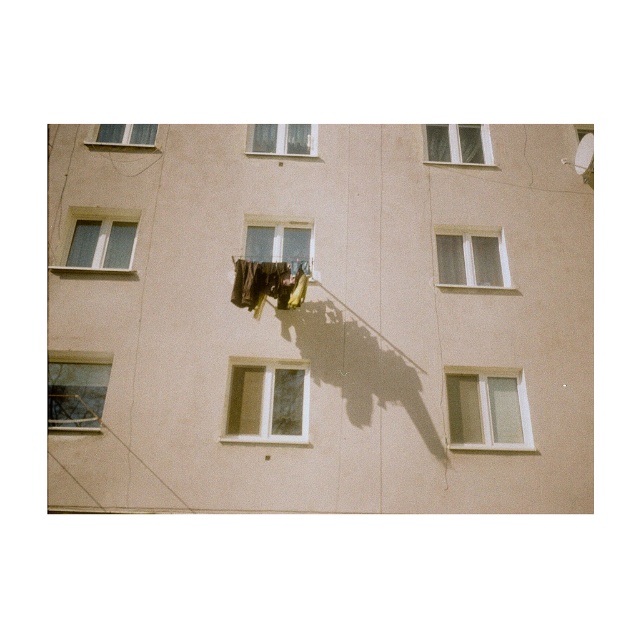
Is clear glass window at lower left to the left of white plastic window at upper right from the viewer's perspective?

Indeed, clear glass window at lower left is positioned on the left side of white plastic window at upper right.

What do you see at coordinates (76, 388) in the screenshot? I see `clear glass window at lower left` at bounding box center [76, 388].

Does point (106, 362) come in front of point (495, 266)?

That is True.

Locate an element on the screen. clear glass window at lower left is located at coordinates click(76, 388).

Looking at this image, who is higher up, white plastic window at center or white plastic window at upper right?

Positioned higher is white plastic window at upper right.

Is white plastic window at center to the left of white plastic window at upper right from the viewer's perspective?

Indeed, white plastic window at center is positioned on the left side of white plastic window at upper right.

This screenshot has height=640, width=636. Describe the element at coordinates (266, 403) in the screenshot. I see `white plastic window at center` at that location.

The height and width of the screenshot is (640, 636). Find the location of `white plastic window at center`. white plastic window at center is located at coordinates [266, 403].

Is white plastic window at lower right to the right of white plastic window at upper right from the viewer's perspective?

Incorrect, white plastic window at lower right is not on the right side of white plastic window at upper right.

Is white plastic window at lower right smaller than white plastic window at upper right?

No.

The width and height of the screenshot is (636, 640). Describe the element at coordinates (487, 410) in the screenshot. I see `white plastic window at lower right` at that location.

You are a GUI agent. You are given a task and a screenshot of the screen. Output one action in this format:
    pyautogui.click(x=<x>, y=<y>)
    Task: Click on the white plastic window at lower right
    
    Given the screenshot: What is the action you would take?
    pyautogui.click(x=487, y=410)